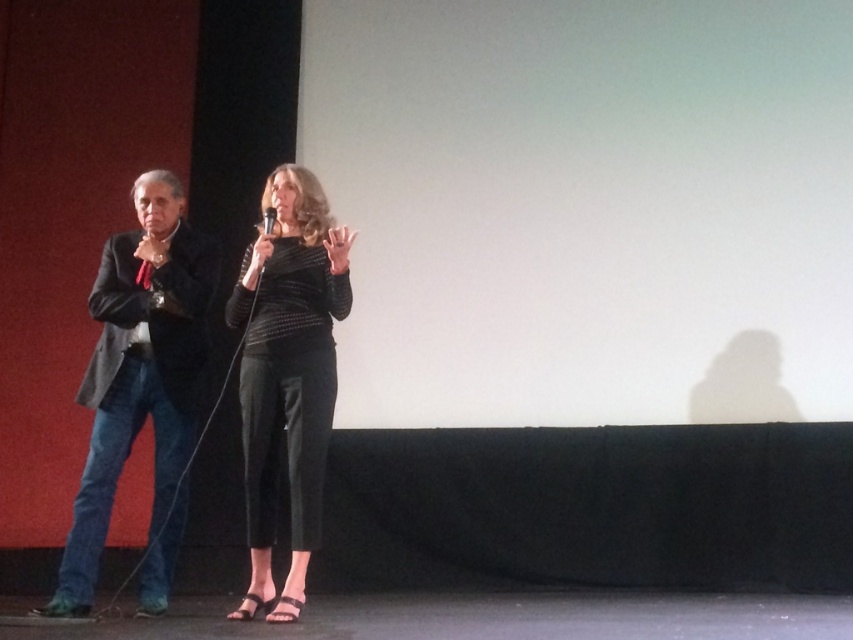
Question: Does dark gray suit at left have a smaller size compared to black matte microphone at center?

Choices:
 (A) yes
 (B) no

Answer: (B)

Question: Observing the image, what is the correct spatial positioning of dark gray suit at left in reference to black matte microphone at center?

Choices:
 (A) above
 (B) below

Answer: (B)

Question: Which of the following is the closest to the observer?

Choices:
 (A) (146, 340)
 (B) (331, 296)
 (C) (265, 230)

Answer: (C)

Question: Which of the following is the farthest from the observer?

Choices:
 (A) dark gray suit at left
 (B) black textured pants at center

Answer: (A)

Question: Is black textured pants at center bigger than black matte microphone at center?

Choices:
 (A) yes
 (B) no

Answer: (A)

Question: Which of the following is the farthest from the observer?

Choices:
 (A) (263, 220)
 (B) (204, 305)

Answer: (A)